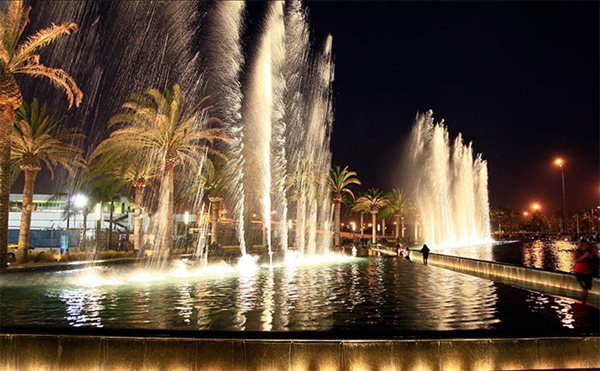
What are the coordinates of `light` in the screenshot? It's located at (78, 197).